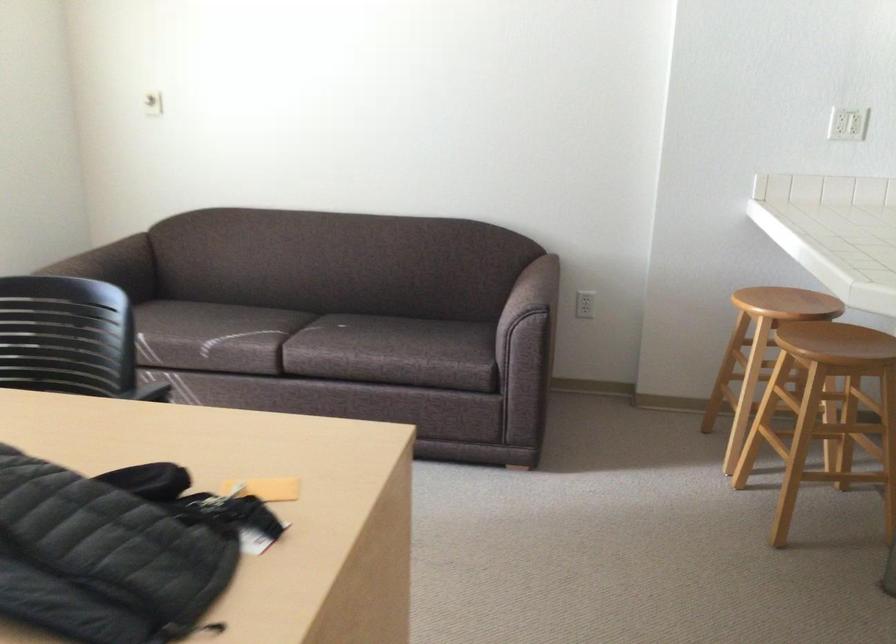
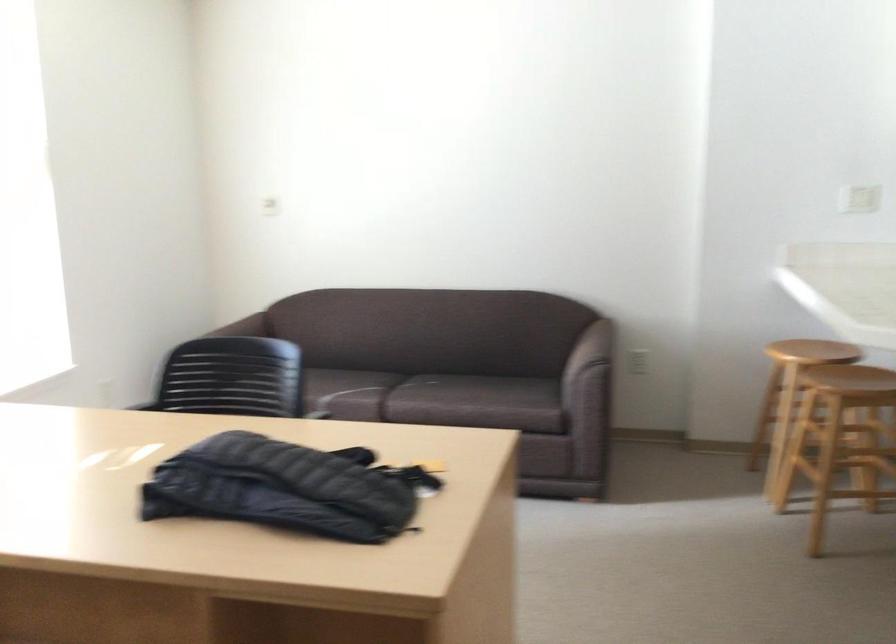
The point at [389,352] is marked in the first image. Where is the corresponding point in the second image?

(475, 401)